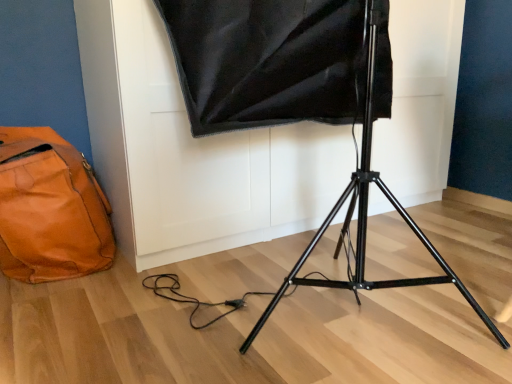
The height and width of the screenshot is (384, 512). In order to click on vacant space situated on the left part of black matte tripod at center in this screenshot , I will do `click(119, 325)`.